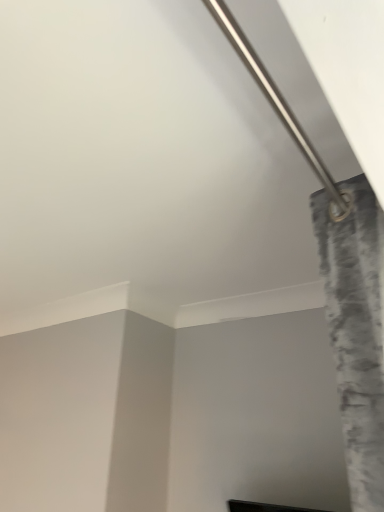
Where is `silver metallic pipe at upper right`? silver metallic pipe at upper right is located at coordinates (280, 106).

What is the approximate width of silver metallic pipe at upper right?

8.57 centimeters.

This screenshot has height=512, width=384. Describe the element at coordinates (280, 106) in the screenshot. I see `silver metallic pipe at upper right` at that location.

Where is `silver metallic pipe at upper right`? silver metallic pipe at upper right is located at coordinates (280, 106).